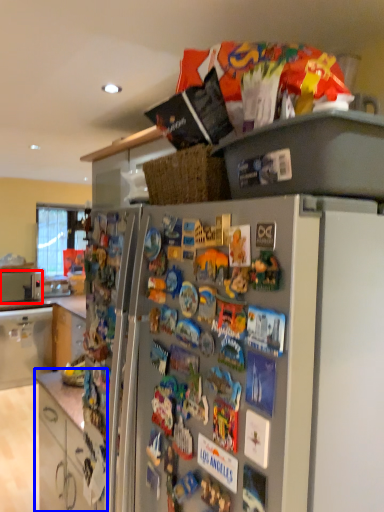
Question: Which object appears farthest to the camera in this image, appliance (highlighted by a red box) or cabinetry (highlighted by a blue box)?

Choices:
 (A) appliance
 (B) cabinetry

Answer: (A)